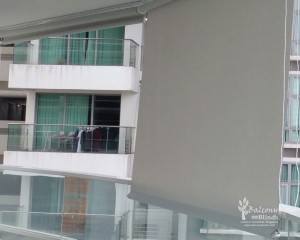
This screenshot has width=300, height=240. Identify the location of privacy screen. (207, 118).